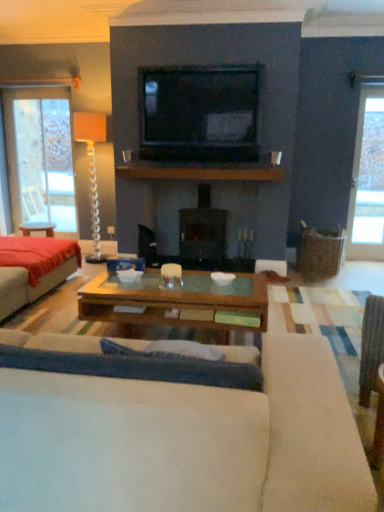
Question: From a real-world perspective, is red fabric bed at left over translucent glass floor lamp at left?

Choices:
 (A) yes
 (B) no

Answer: (B)

Question: Is red fabric bed at left positioned behind translucent glass floor lamp at left?

Choices:
 (A) yes
 (B) no

Answer: (B)

Question: Considering the relative sizes of red fabric bed at left and translucent glass floor lamp at left in the image provided, is red fabric bed at left smaller than translucent glass floor lamp at left?

Choices:
 (A) yes
 (B) no

Answer: (B)

Question: From the image's perspective, is red fabric bed at left over translucent glass floor lamp at left?

Choices:
 (A) no
 (B) yes

Answer: (A)

Question: Is red fabric bed at left located outside translucent glass floor lamp at left?

Choices:
 (A) yes
 (B) no

Answer: (A)

Question: From a real-world perspective, relative to translucent glass floor lamp at left, is clear glass window at left, which is counted as the first window, starting from the left, vertically above or below?

Choices:
 (A) below
 (B) above

Answer: (B)

Question: Does point (49, 128) appear closer or farther from the camera than point (96, 219)?

Choices:
 (A) farther
 (B) closer

Answer: (B)

Question: Choose the correct answer: Is clear glass window at left, which ranks as the 1th window in back-to-front order, inside translucent glass floor lamp at left or outside it?

Choices:
 (A) inside
 (B) outside

Answer: (B)

Question: From their relative heights in the image, would you say clear glass window at left, the 2th window in the right-to-left sequence, is taller or shorter than translucent glass floor lamp at left?

Choices:
 (A) short
 (B) tall

Answer: (B)

Question: From a real-world perspective, is black glossy tv at upper center above or below translucent glass floor lamp at left?

Choices:
 (A) below
 (B) above

Answer: (B)

Question: Is black glossy tv at upper center wider or thinner than translucent glass floor lamp at left?

Choices:
 (A) thin
 (B) wide

Answer: (A)

Question: Considering the positions of point (221, 138) and point (94, 196), is point (221, 138) closer or farther from the camera than point (94, 196)?

Choices:
 (A) farther
 (B) closer

Answer: (B)

Question: Considering their positions, is black glossy tv at upper center located in front of or behind translucent glass floor lamp at left?

Choices:
 (A) behind
 (B) front

Answer: (B)

Question: From their relative heights in the image, would you say brown wooden mantle at center is taller or shorter than translucent glass floor lamp at left?

Choices:
 (A) tall
 (B) short

Answer: (B)

Question: From the image's perspective, is brown wooden mantle at center located above or below translucent glass floor lamp at left?

Choices:
 (A) above
 (B) below

Answer: (A)